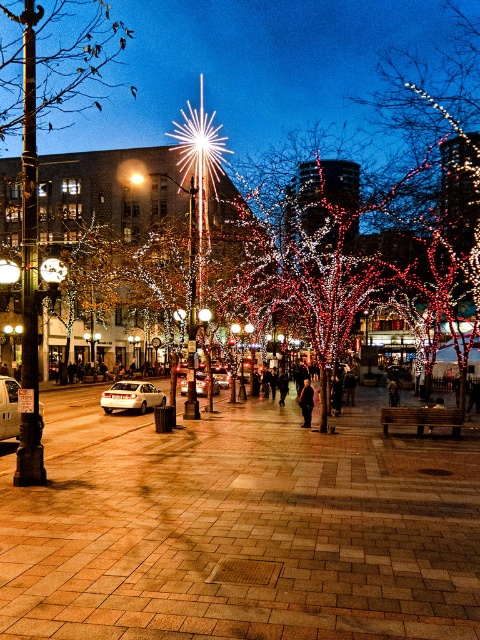
You are standing at the point marked by the coordinates [240,529] in the image. What type of surface are you currently standing on?

The point at coordinates [240,529] indicates brick pavement at center, so you are standing on brick pavement.

You are a delivery person trying to deliver a package to the dark gray coat at center. The brick pavement at center is in your way. Can you walk around it?

The brick pavement at center is much taller than the dark gray coat at center, so you can walk around it by stepping over the brick pavement at center.